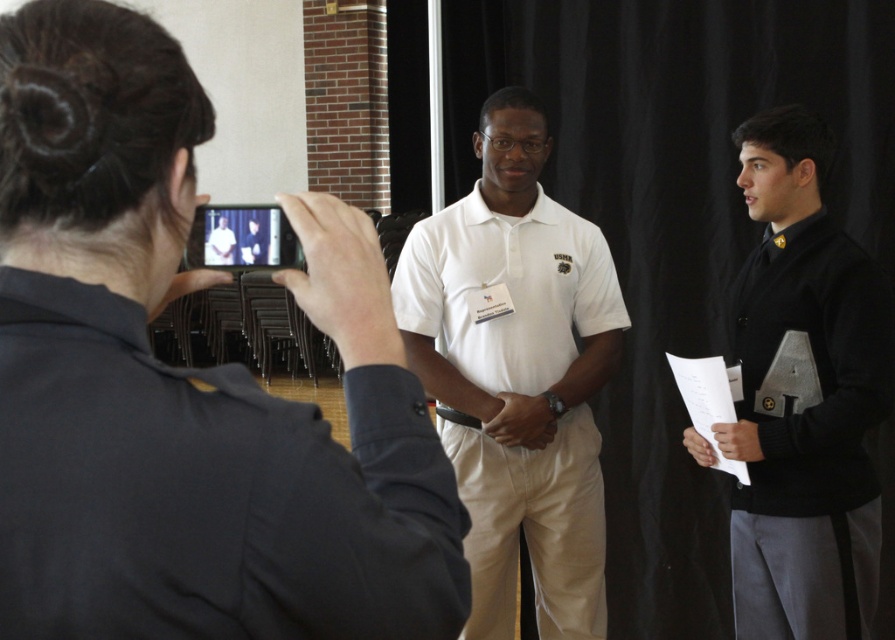
You are a photographer trying to focus your camera on the black fabric at upper left and the black matte sweater at center. Which object should you adjust your focus to first if you want to capture both in the same frame?

The black fabric at upper left is above the black matte sweater at center, so you should focus on the black matte sweater at center first to ensure both are in the frame.

You are a photographer trying to frame a shot. You notice the black fabric at upper left and the white matte shirt at center in your viewfinder. Which object should you adjust your focus to ensure the larger subject is in the frame?

The white matte shirt at center is larger in the frame since it occupies more space than the black fabric at upper left. Adjust focus to include the white matte shirt at center properly.

You are a photographer trying to adjust your composition. Which object is positioned higher in the frame between the black fabric at upper left and the white matte shirt at center?

The black fabric at upper left is located above the white matte shirt at center in the frame.